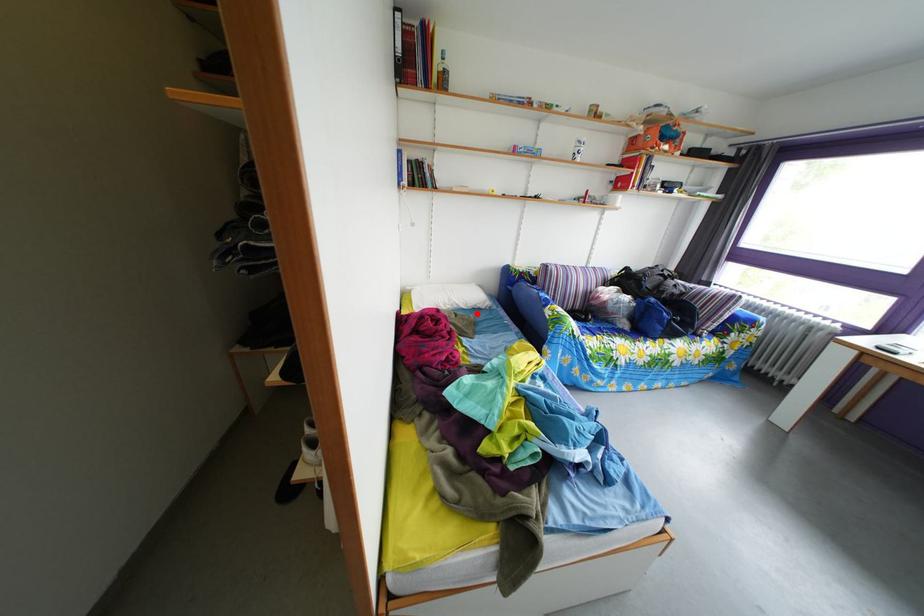
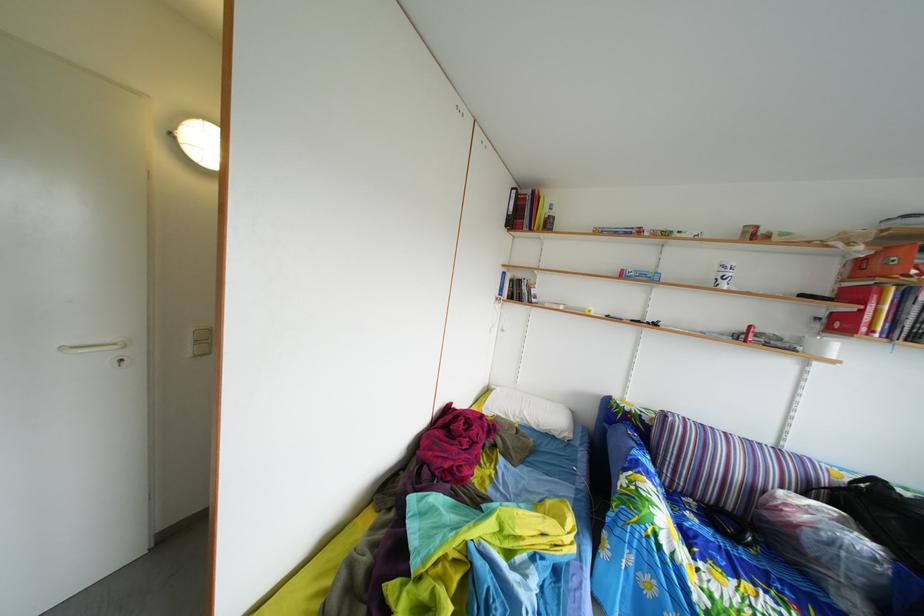
Question: I am providing you with two images of the same scene from different viewpoints. In image1, a red point is highlighted. Considering the same 3D point in image2, which of the following is correct?

Choices:
 (A) It is closer
 (B) It is farther

Answer: (B)